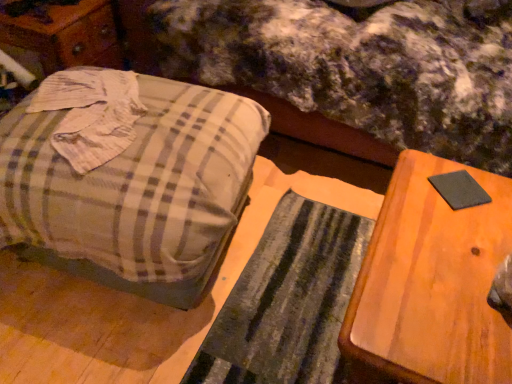
Where is `free point in front of black felt pad at right`? The image size is (512, 384). free point in front of black felt pad at right is located at coordinates (463, 244).